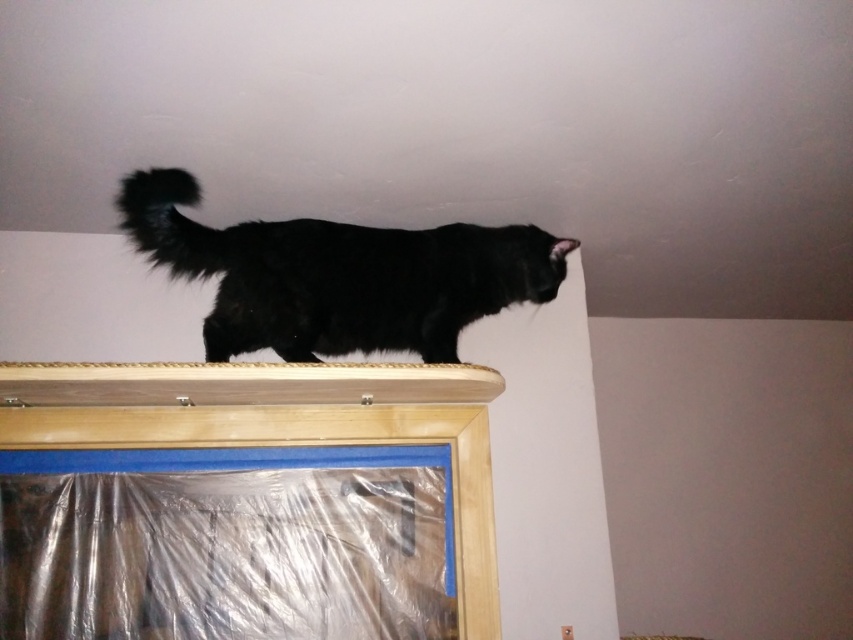
Consider the image. You are standing in a room and see the black fluffy cat at upper center. Based on its position, can you determine if it is closer to the corner where the two walls meet or the plastic sheet below?

The black fluffy cat at upper center is located at point [338,275], which places it closer to the corner where the two walls meet than the plastic sheet below.

You are a visitor in a house and see the black fluffy cat at upper center and the fluffy black tail at upper center. Which one is positioned more to the right side of the room?

The black fluffy cat at upper center is positioned more to the right side of the room because it is to the right of the fluffy black tail at upper center.

You are a photographer trying to capture the black fluffy cat at upper center and the fluffy black tail at upper center in a single shot. Which object should you focus on first to ensure both are in focus?

You should focus on the black fluffy cat at upper center first because it is closer to you than the fluffy black tail at upper center, so focusing on the closer object will help both be in focus.